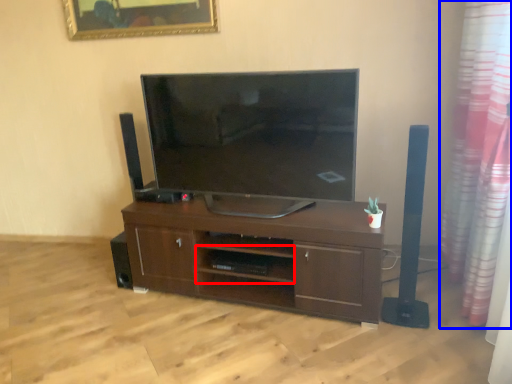
Question: Which object appears closest to the camera in this image, shelf (highlighted by a red box) or curtain (highlighted by a blue box)?

Choices:
 (A) shelf
 (B) curtain

Answer: (B)